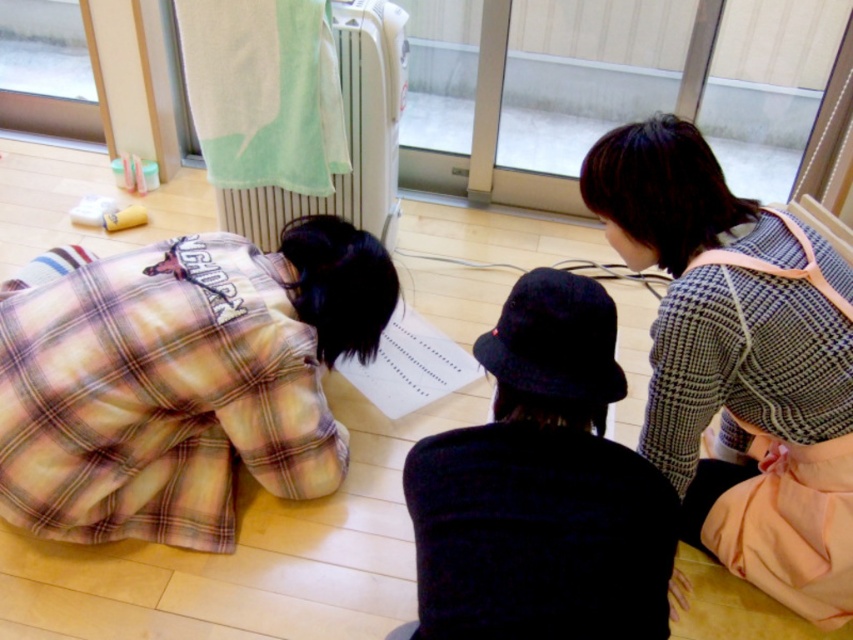
Between checkered fabric sweater at upper right and white plastic radiator at upper center, which one appears on the left side from the viewer's perspective?

From the viewer's perspective, white plastic radiator at upper center appears more on the left side.

Identify the location of checkered fabric sweater at upper right. (740, 364).

Between checkered fabric sweater at upper right and transparent glass door at upper center, which one has more height?

With more height is checkered fabric sweater at upper right.

Between point (824, 307) and point (711, 99), which one is positioned in front?

Point (824, 307)

Locate an element on the screen. The height and width of the screenshot is (640, 853). checkered fabric sweater at upper right is located at coordinates (740, 364).

From the picture: Can you confirm if checkered fabric sweater at upper right is thinner than transparent plastic screen door at upper left?

Yes.

Between checkered fabric sweater at upper right and transparent plastic screen door at upper left, which one appears on the right side from the viewer's perspective?

Positioned to the right is checkered fabric sweater at upper right.

From the picture: Who is more distant from viewer, (792,529) or (76,113)?

Positioned behind is point (76,113).

Find the location of a particular element. This screenshot has height=640, width=853. checkered fabric sweater at upper right is located at coordinates (740, 364).